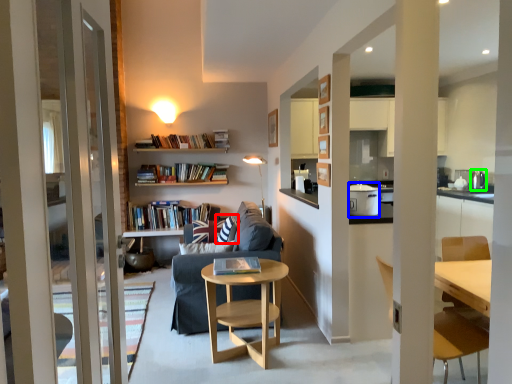
Question: Considering the real-world distances, which object is farthest from pillow (highlighted by a red box)? appliance (highlighted by a blue box) or appliance (highlighted by a green box)?

Choices:
 (A) appliance
 (B) appliance

Answer: (B)